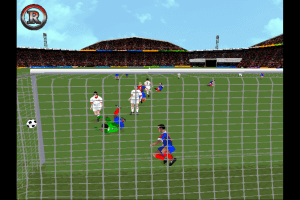
The width and height of the screenshot is (300, 200). I want to click on fans, so click(24, 56), click(95, 57), click(170, 60), click(274, 56).